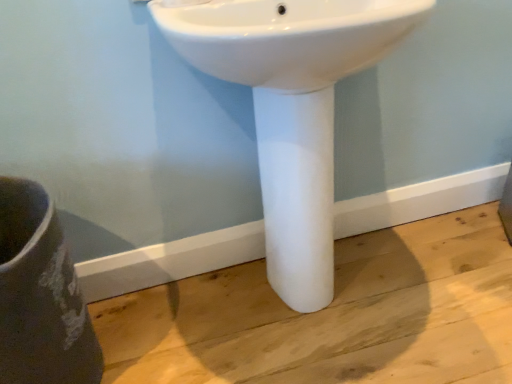
Find the location of `vacant space in white glossy sink at center (from a real-world perspective)`. vacant space in white glossy sink at center (from a real-world perspective) is located at coordinates (312, 308).